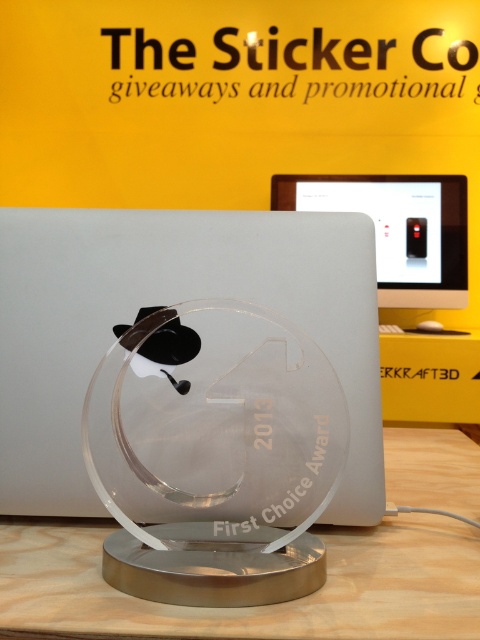
You are holding a ruler and want to measure the distance between the satin silver laptop at center and yourself. If your ruler is 12 inches long, can you measure the entire distance with just one ruler?

The distance between the satin silver laptop at center and the viewer is 18.02 inches, which is longer than the 12 inches ruler. Therefore, you cannot measure the entire distance with just one ruler.

You are setting up a desk and need to place the white plastic monitor at center and the black plastic mouse at center. Since you have limited vertical space, which object should you prioritize placing lower to avoid exceeding the height limit?

The black plastic mouse at center should be placed lower because the white plastic monitor at center is taller than the black plastic mouse at center, so the monitor requires more vertical space.